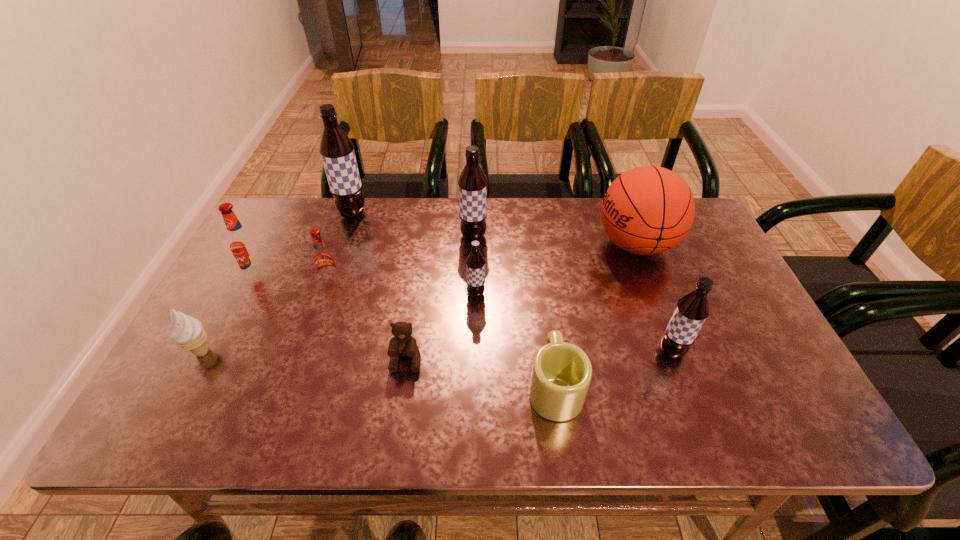
At what (x,y) coordinates should I click in order to perform the action: click on object that is at the near edge. Please return your answer as a coordinate pair (x, y). This screenshot has height=540, width=960. Looking at the image, I should click on (561, 374).

At what (x,y) coordinates should I click in order to perform the action: click on root beer at the left edge. Please return your answer as a coordinate pair (x, y). Looking at the image, I should click on (242, 243).

At what (x,y) coordinates should I click in order to perform the action: click on icecream at the left edge. Please return your answer as a coordinate pair (x, y). The height and width of the screenshot is (540, 960). Looking at the image, I should click on (187, 331).

Where is `object positioned at the right edge`? This screenshot has height=540, width=960. object positioned at the right edge is located at coordinates (647, 210).

At what (x,y) coordinates should I click in order to perform the action: click on object situated at the far right corner. Please return your answer as a coordinate pair (x, y). Looking at the image, I should click on (647, 210).

In the image, there is a desktop. Identify the location of vacant space at the far edge. (356, 233).

Identify the location of free space at the near edge. This screenshot has width=960, height=540. (657, 422).

At what (x,y) coordinates should I click in order to perform the action: click on vacant region at the left edge of the desktop. Please return your answer as a coordinate pair (x, y). Looking at the image, I should click on (275, 245).

What are the coordinates of `vacant space at the right edge` in the screenshot? It's located at (753, 359).

The image size is (960, 540). In order to click on vacant space at the near right corner of the desktop in this screenshot , I will do `click(748, 426)`.